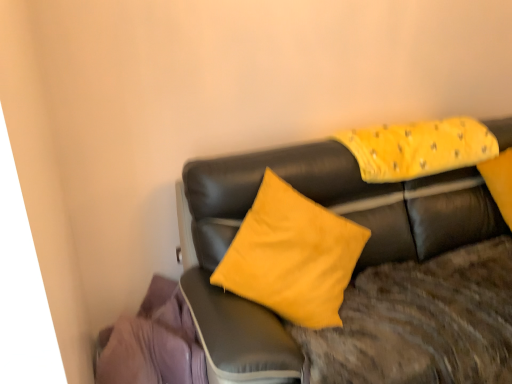
Question: Does yellow fabric pillow at upper right have a lesser width compared to purple fabric at lower left?

Choices:
 (A) no
 (B) yes

Answer: (B)

Question: Can you confirm if yellow fabric pillow at upper right is positioned to the left of purple fabric at lower left?

Choices:
 (A) yes
 (B) no

Answer: (B)

Question: From a real-world perspective, is yellow fabric pillow at upper right physically below purple fabric at lower left?

Choices:
 (A) no
 (B) yes

Answer: (A)

Question: From the image's perspective, does yellow fabric pillow at upper right appear higher than purple fabric at lower left?

Choices:
 (A) yes
 (B) no

Answer: (A)

Question: Is yellow fabric pillow at upper right positioned beyond the bounds of purple fabric at lower left?

Choices:
 (A) yes
 (B) no

Answer: (A)

Question: Would you say purple fabric at lower left is inside or outside matte black couch at center?

Choices:
 (A) inside
 (B) outside

Answer: (B)

Question: From a real-world perspective, relative to matte black couch at center, is purple fabric at lower left vertically above or below?

Choices:
 (A) above
 (B) below

Answer: (B)

Question: In terms of size, does purple fabric at lower left appear bigger or smaller than matte black couch at center?

Choices:
 (A) big
 (B) small

Answer: (B)

Question: Is point pyautogui.click(x=144, y=382) positioned closer to the camera than point pyautogui.click(x=273, y=331)?

Choices:
 (A) farther
 (B) closer

Answer: (A)

Question: From a real-world perspective, is yellow fabric pillow at upper right positioned above or below matte black couch at center?

Choices:
 (A) below
 (B) above

Answer: (B)

Question: Relative to matte black couch at center, is yellow fabric pillow at upper right in front or behind?

Choices:
 (A) behind
 (B) front

Answer: (A)

Question: Based on their sizes in the image, would you say yellow fabric pillow at upper right is bigger or smaller than matte black couch at center?

Choices:
 (A) big
 (B) small

Answer: (B)

Question: From the image's perspective, relative to matte black couch at center, is yellow fabric pillow at upper right above or below?

Choices:
 (A) below
 (B) above

Answer: (B)

Question: Is yellow fabric pillow at upper right inside or outside of purple fabric at lower left?

Choices:
 (A) outside
 (B) inside

Answer: (A)

Question: From the image's perspective, relative to purple fabric at lower left, is yellow fabric pillow at upper right above or below?

Choices:
 (A) below
 (B) above

Answer: (B)